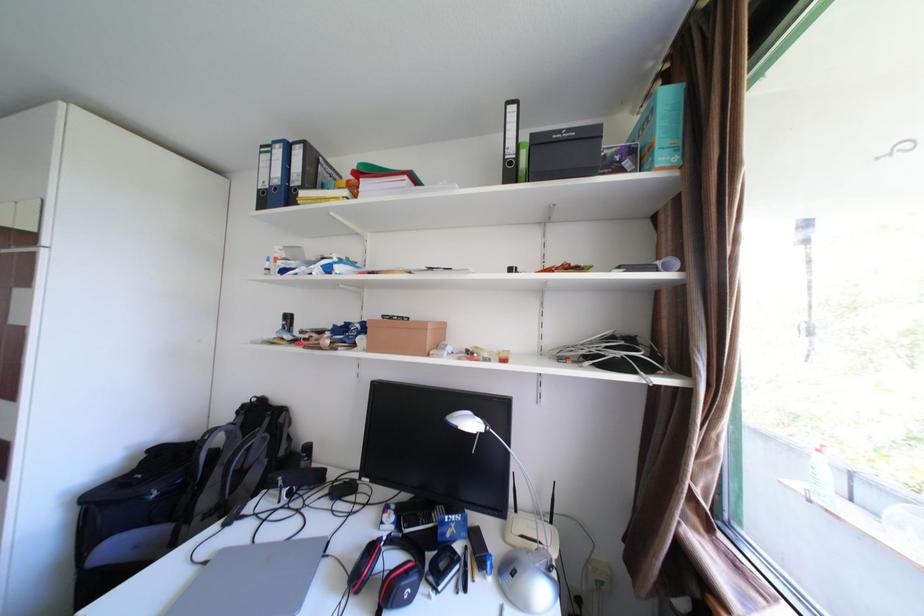
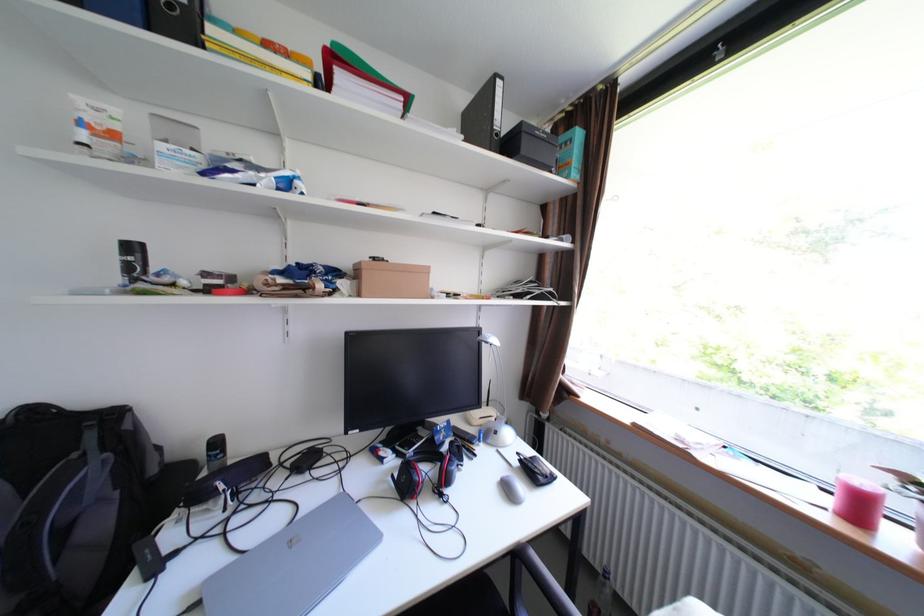
In the second image, find the point that corresponds to the point at 299,317 in the first image.

(143, 248)